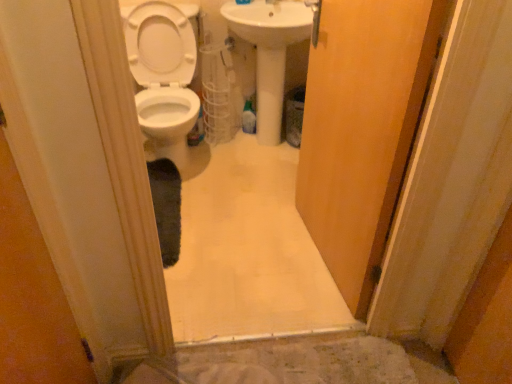
Question: In terms of size, does white glossy toilet at left appear bigger or smaller than white glossy sink at center?

Choices:
 (A) small
 (B) big

Answer: (B)

Question: Would you say white glossy toilet at left is inside or outside white glossy sink at center?

Choices:
 (A) outside
 (B) inside

Answer: (A)

Question: Estimate the real-world distances between objects in this image. Which object is farther from the wooden door at center?

Choices:
 (A) white glossy sink at center
 (B) white glossy toilet at left

Answer: (B)

Question: Estimate the real-world distances between objects in this image. Which object is farther from the white glossy sink at center?

Choices:
 (A) white glossy toilet at left
 (B) wooden door at center

Answer: (B)